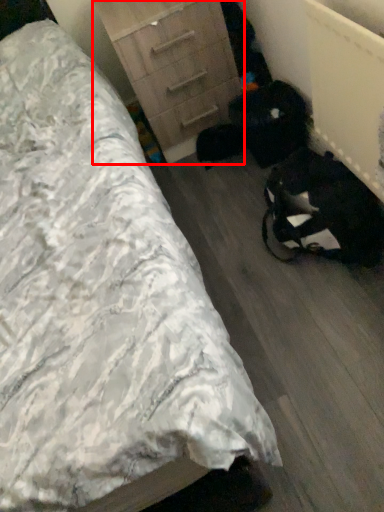
Question: From the image's perspective, where is chest of drawers (annotated by the red box) located in relation to bed in the image?

Choices:
 (A) above
 (B) below

Answer: (A)